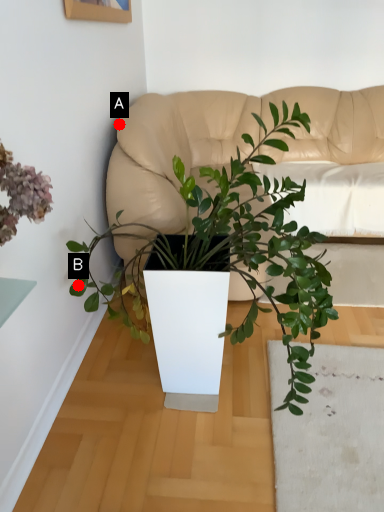
Question: Two points are circled on the image, labeled by A and B beside each circle. Among these points, which one is nearest to the camera?

Choices:
 (A) A is closer
 (B) B is closer

Answer: (B)